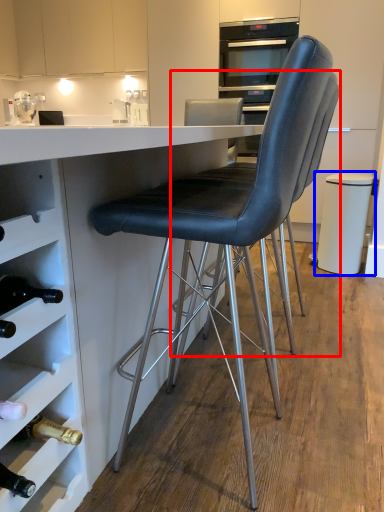
Question: Which point is closer to the camera, chair (highlighted by a red box) or bar stool (highlighted by a blue box)?

Choices:
 (A) chair
 (B) bar stool

Answer: (A)